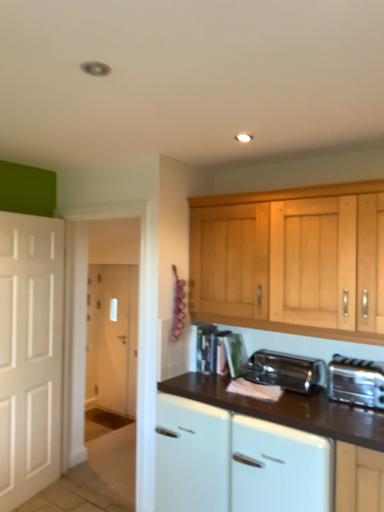
In order to face white glossy dishwasher at lower center, should I rotate leftwards or rightwards?

Rotate right and turn 14.507 degrees.

Image resolution: width=384 pixels, height=512 pixels. I want to click on satin chrome toaster at lower center, so click(286, 371).

Considering the points (258, 351) and (373, 364), which point is behind, point (258, 351) or point (373, 364)?

The point (258, 351) is behind.

Is satin chrome toaster at lower center looking in the opposite direction of silver metallic toaster at lower right?

No, silver metallic toaster at lower right is not at the back of satin chrome toaster at lower center.

From the image's perspective, is satin chrome toaster at lower center below silver metallic toaster at lower right?

Yes, from the image's perspective, satin chrome toaster at lower center is beneath silver metallic toaster at lower right.

I want to click on kitchen appliance on the left side of silver metallic toaster at lower right, so click(286, 371).

Is the depth of white glossy cabinet at center greater than that of silver metallic toaster at lower right?

Yes, it is.

From a real-world perspective, is white glossy cabinet at center below silver metallic toaster at lower right?

Yes, from a real-world perspective, white glossy cabinet at center is below silver metallic toaster at lower right.

Is point (237, 444) closer or farther from the camera than point (380, 364)?

Point (237, 444) is closer to the camera than point (380, 364).

From a real-world perspective, is white glossy dishwasher at lower center positioned under white glossy cabinet at center based on gravity?

No, from a real-world perspective, white glossy dishwasher at lower center is not below white glossy cabinet at center.

Consider the image. Is white glossy dishwasher at lower center positioned before white glossy cabinet at center?

That is True.

Can you confirm if white glossy dishwasher at lower center is taller than white glossy cabinet at center?

No.

Is point (282, 455) closer to camera compared to point (213, 466)?

That is True.

Which is more to the left, white glossy cabinet at center or satin chrome toaster at lower center?

white glossy cabinet at center is more to the left.

Are white glossy cabinet at center and satin chrome toaster at lower center beside each other?

white glossy cabinet at center and satin chrome toaster at lower center are clearly separated.

Considering the sizes of white glossy cabinet at center and satin chrome toaster at lower center in the image, is white glossy cabinet at center taller or shorter than satin chrome toaster at lower center?

white glossy cabinet at center is taller than satin chrome toaster at lower center.

Considering the positions of objects white glossy cabinet at center and satin chrome toaster at lower center in the image provided, who is behind, white glossy cabinet at center or satin chrome toaster at lower center?

satin chrome toaster at lower center is further away from the camera.

Measure the distance between white glossy dishwasher at lower center and satin chrome toaster at lower center.

The distance of white glossy dishwasher at lower center from satin chrome toaster at lower center is 19.46 inches.

Is white glossy dishwasher at lower center completely or partially outside of satin chrome toaster at lower center?

That's correct, white glossy dishwasher at lower center is outside of satin chrome toaster at lower center.

From a real-world perspective, which is physically below, white glossy dishwasher at lower center or satin chrome toaster at lower center?

In real-world perspective, white glossy dishwasher at lower center is lower.

Considering the positions of point (309, 471) and point (315, 390), is point (309, 471) closer or farther from the camera than point (315, 390)?

Point (309, 471).

Between white glossy dishwasher at lower center and silver metallic toaster at lower right, which one has larger width?

white glossy dishwasher at lower center is wider.

From a real-world perspective, which object stands above the other?

silver metallic toaster at lower right is physically above.

Is white glossy dishwasher at lower center turned away from silver metallic toaster at lower right?

No, white glossy dishwasher at lower center is not facing the opposite direction of silver metallic toaster at lower right.

Is white glossy dishwasher at lower center with silver metallic toaster at lower right?

They are not placed beside each other.

Is silver metallic toaster at lower right positioned with its back to white glossy cabinet at center?

That's not correct — silver metallic toaster at lower right is not looking away from white glossy cabinet at center.

Is silver metallic toaster at lower right bigger than white glossy cabinet at center?

No, silver metallic toaster at lower right is not bigger than white glossy cabinet at center.

From a real-world perspective, does silver metallic toaster at lower right stand above white glossy cabinet at center?

Yes, from a real-world perspective, silver metallic toaster at lower right is over white glossy cabinet at center

Identify the location of toaster positioned vertically above the satin chrome toaster at lower center (from a real-world perspective). (356, 381).

Where is `toaster above the white glossy cabinet at center (from the image's perspective)`? The image size is (384, 512). toaster above the white glossy cabinet at center (from the image's perspective) is located at coordinates point(356,381).

Considering their positions, is satin chrome toaster at lower center positioned further to white glossy cabinet at center than silver metallic toaster at lower right?

silver metallic toaster at lower right.

Looking at the image, which one is located closer to white glossy dishwasher at lower center, white glossy cabinet at center or silver metallic toaster at lower right?

Based on the image, white glossy cabinet at center appears to be nearer to white glossy dishwasher at lower center.

Looking at the image, which one is located further to white glossy cabinet at center, white glossy dishwasher at lower center or satin chrome toaster at lower center?

satin chrome toaster at lower center.

Estimate the real-world distances between objects in this image. Which object is closer to white glossy dishwasher at lower center, satin chrome toaster at lower center or silver metallic toaster at lower right?

silver metallic toaster at lower right lies closer to white glossy dishwasher at lower center than the other object.

Based on their spatial positions, is satin chrome toaster at lower center or white glossy dishwasher at lower center further from silver metallic toaster at lower right?

white glossy dishwasher at lower center.

Estimate the real-world distances between objects in this image. Which object is closer to satin chrome toaster at lower center, white glossy cabinet at center or white glossy dishwasher at lower center?

Based on the image, white glossy dishwasher at lower center appears to be nearer to satin chrome toaster at lower center.

In the scene shown: Estimate the real-world distances between objects in this image. Which object is closer to white glossy dishwasher at lower center, silver metallic toaster at lower right or white glossy cabinet at center?

white glossy cabinet at center is positioned closer to the anchor white glossy dishwasher at lower center.

Estimate the real-world distances between objects in this image. Which object is closer to silver metallic toaster at lower right, white glossy cabinet at center or satin chrome toaster at lower center?

satin chrome toaster at lower center.

I want to click on kitchen appliance that lies between silver metallic toaster at lower right and white glossy dishwasher at lower center from top to bottom, so click(286, 371).

The width and height of the screenshot is (384, 512). I want to click on dish washer that lies between satin chrome toaster at lower center and white glossy cabinet at center from top to bottom, so click(x=279, y=468).

The width and height of the screenshot is (384, 512). In order to click on dish washer located between white glossy cabinet at center and silver metallic toaster at lower right in the left-right direction in this screenshot , I will do [279, 468].

Where is `kitchen appliance between white glossy cabinet at center and silver metallic toaster at lower right in the horizontal direction`? The height and width of the screenshot is (512, 384). kitchen appliance between white glossy cabinet at center and silver metallic toaster at lower right in the horizontal direction is located at coordinates (286, 371).